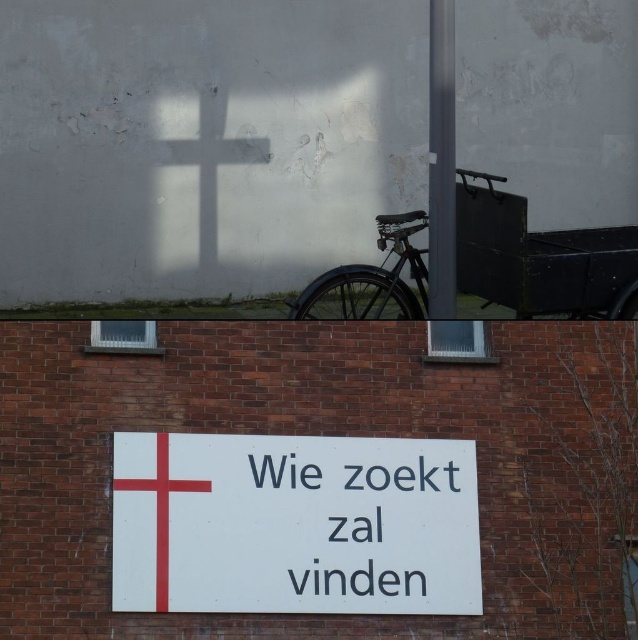
Can you confirm if white matte sign at center is taller than white paper sign at center?

Indeed, white matte sign at center has a greater height compared to white paper sign at center.

What are the coordinates of `white matte sign at center` in the screenshot? It's located at 293,524.

Is point (367, 477) closer to camera compared to point (360, 532)?

No, (367, 477) is further to viewer.

I want to click on white matte sign at center, so click(293, 524).

Which is below, metallic pole at upper right or matte black bicycle at center?

Positioned lower is matte black bicycle at center.

From the picture: Can you confirm if metallic pole at upper right is positioned to the left of matte black bicycle at center?

In fact, metallic pole at upper right is to the right of matte black bicycle at center.

Is point (443, 177) farther from camera compared to point (420, 220)?

No, it is not.

Where is `metallic pole at upper right`? This screenshot has width=638, height=640. metallic pole at upper right is located at coordinates (441, 161).

Does white paper sign at center have a greater width compared to matte black bicycle at center?

Yes.

Which is below, white paper sign at center or matte black bicycle at center?

white paper sign at center is lower down.

Is point (401, 547) more distant than point (412, 252)?

That is True.

Image resolution: width=638 pixels, height=640 pixels. Identify the location of white paper sign at center. (366, 518).